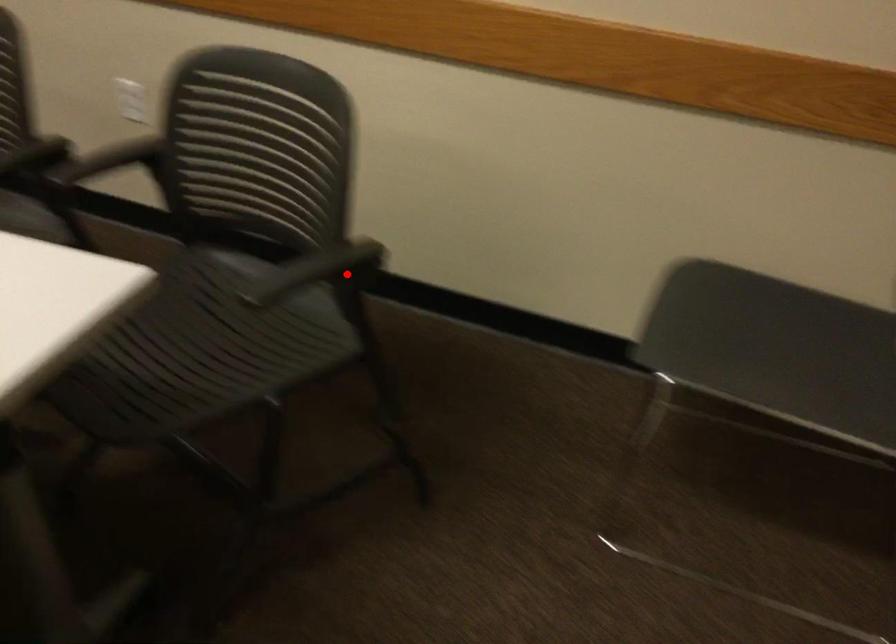
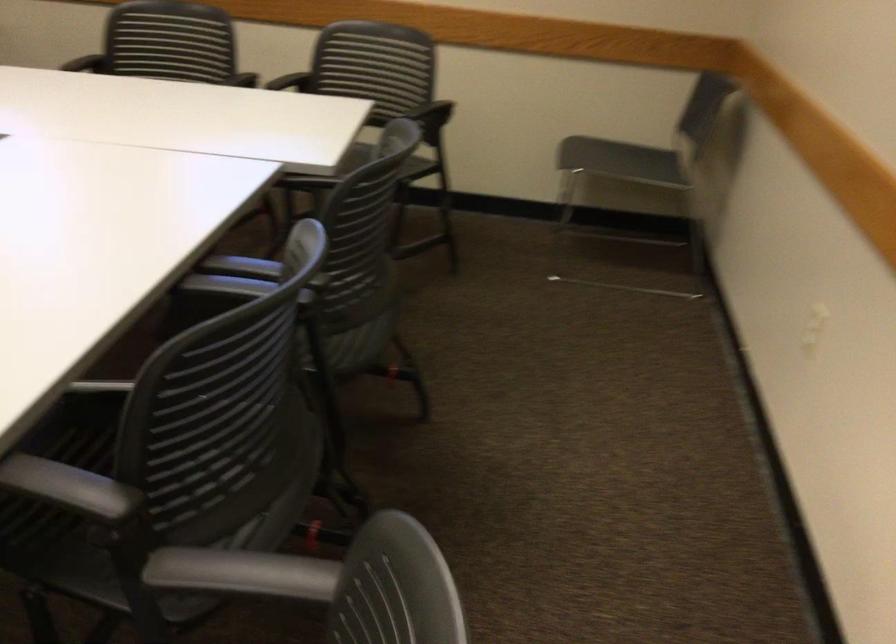
In the second image, find the point that corresponds to the highlighted location in the first image.

(433, 118)